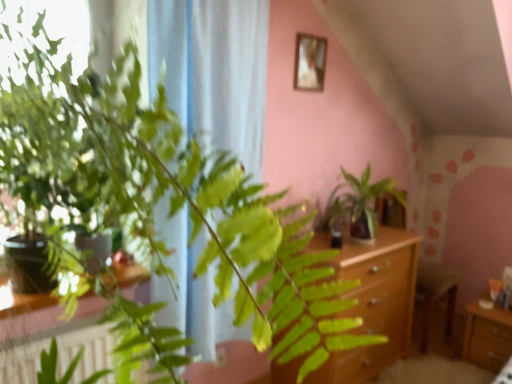
Question: Is white sheer curtain at left in contact with light brown wooden dresser at center?

Choices:
 (A) no
 (B) yes

Answer: (A)

Question: Is white sheer curtain at left wider than light brown wooden dresser at center?

Choices:
 (A) no
 (B) yes

Answer: (A)

Question: Considering the relative sizes of white sheer curtain at left and light brown wooden dresser at center in the image provided, is white sheer curtain at left taller than light brown wooden dresser at center?

Choices:
 (A) no
 (B) yes

Answer: (B)

Question: From a real-world perspective, is white sheer curtain at left below light brown wooden dresser at center?

Choices:
 (A) no
 (B) yes

Answer: (A)

Question: Is white sheer curtain at left oriented towards light brown wooden dresser at center?

Choices:
 (A) yes
 (B) no

Answer: (B)

Question: Considering the relative positions of wooden frame at upper center and white sheer curtain at left in the image provided, is wooden frame at upper center to the left or to the right of white sheer curtain at left?

Choices:
 (A) right
 (B) left

Answer: (A)

Question: From a real-world perspective, relative to white sheer curtain at left, is wooden frame at upper center vertically above or below?

Choices:
 (A) below
 (B) above

Answer: (B)

Question: From the image's perspective, is wooden frame at upper center positioned above or below white sheer curtain at left?

Choices:
 (A) below
 (B) above

Answer: (B)

Question: In terms of width, does wooden frame at upper center look wider or thinner when compared to white sheer curtain at left?

Choices:
 (A) wide
 (B) thin

Answer: (B)

Question: Would you say wooden drawer at lower right is to the left or to the right of wooden frame at upper center in the picture?

Choices:
 (A) left
 (B) right

Answer: (B)

Question: Considering the positions of point (474, 312) and point (308, 72), is point (474, 312) closer or farther from the camera than point (308, 72)?

Choices:
 (A) farther
 (B) closer

Answer: (A)

Question: Is wooden drawer at lower right taller or shorter than wooden frame at upper center?

Choices:
 (A) tall
 (B) short

Answer: (A)

Question: In terms of width, does wooden drawer at lower right look wider or thinner when compared to wooden frame at upper center?

Choices:
 (A) wide
 (B) thin

Answer: (A)

Question: Does point (243, 21) appear closer or farther from the camera than point (499, 370)?

Choices:
 (A) farther
 (B) closer

Answer: (B)

Question: From the image's perspective, is white sheer curtain at left above or below wooden drawer at lower right?

Choices:
 (A) above
 (B) below

Answer: (A)